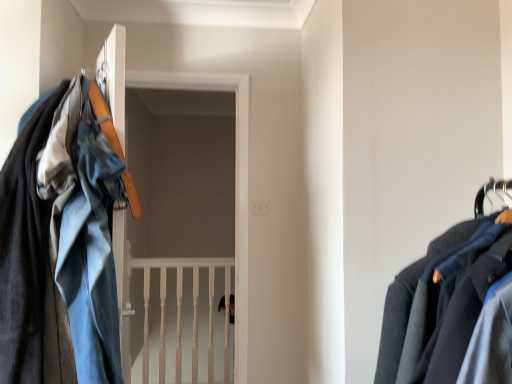
The image size is (512, 384). What do you see at coordinates (30, 266) in the screenshot?
I see `matte black jacket at left` at bounding box center [30, 266].

The width and height of the screenshot is (512, 384). In order to click on matte black jacket at left in this screenshot , I will do `click(30, 266)`.

Find the location of a particular element. The image size is (512, 384). matte black jacket at left is located at coordinates (30, 266).